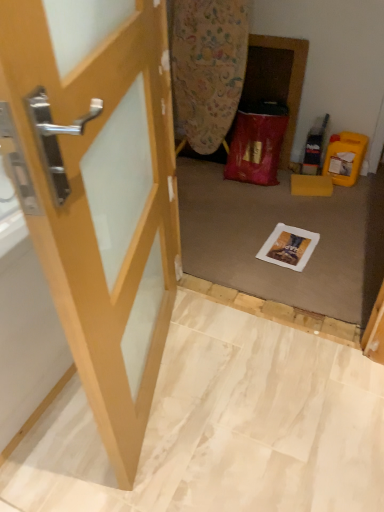
Identify the location of vacant space to the right of light wood door at left. The height and width of the screenshot is (512, 384). (254, 390).